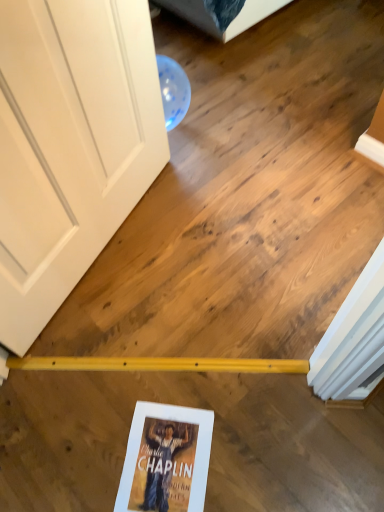
Where is `blank space situated above hardcover book at lower center (from a real-world perspective)`? blank space situated above hardcover book at lower center (from a real-world perspective) is located at coordinates (164, 466).